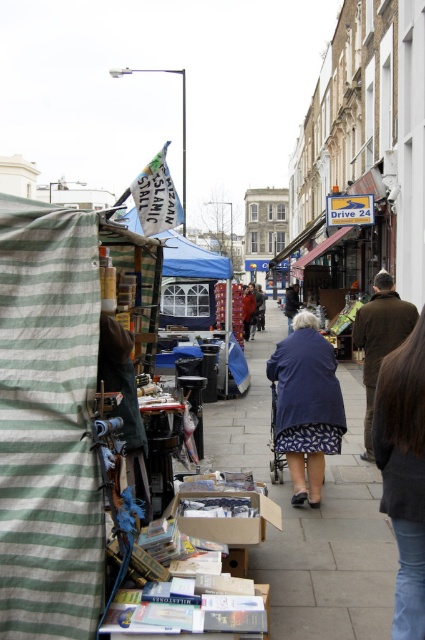
Question: Does brown leather jacket at right have a smaller size compared to blue fabric jacket at center?

Choices:
 (A) no
 (B) yes

Answer: (B)

Question: Considering the real-world distances, which object is farthest from the blue fabric jacket at center?

Choices:
 (A) blue fabric canopy at upper center
 (B) blue fabric at center

Answer: (B)

Question: Which point is farther to the camera?

Choices:
 (A) (249, 314)
 (B) (394, 336)

Answer: (A)

Question: Is brown leather jacket at right smaller than blue fabric jacket at center?

Choices:
 (A) no
 (B) yes

Answer: (B)

Question: Can you confirm if blue fabric at center is positioned to the left of blue fabric jacket at center?

Choices:
 (A) no
 (B) yes

Answer: (A)

Question: Which object appears closest to the camera in this image?

Choices:
 (A) brown leather jacket at right
 (B) blue fabric at center
 (C) blue fabric canopy at upper center
 (D) blue fabric jacket at center

Answer: (C)